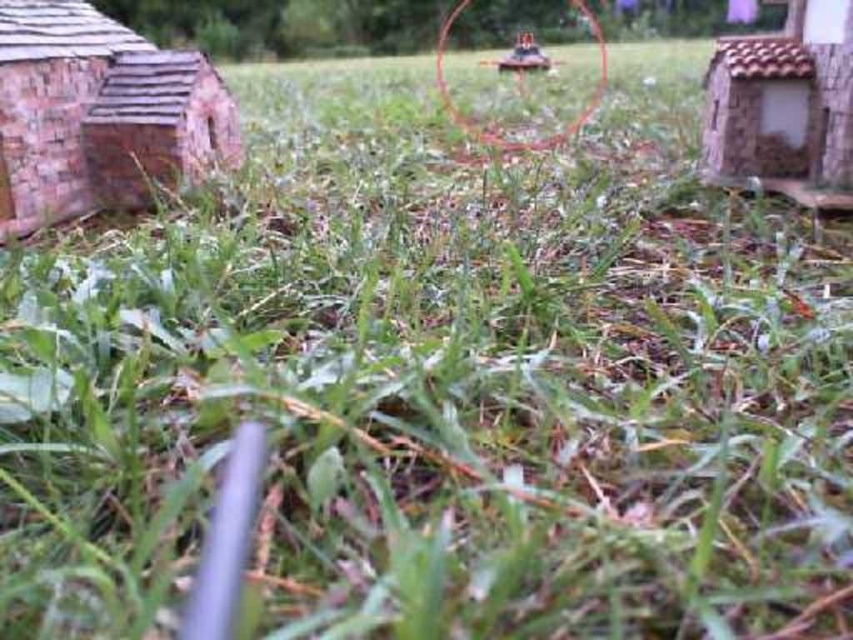
Question: Which point appears closest to the camera in this image?

Choices:
 (A) (486, 61)
 (B) (180, 125)

Answer: (B)

Question: Which of the following is the farthest from the observer?

Choices:
 (A) (796, 177)
 (B) (546, 65)

Answer: (B)

Question: Is rustic stone hut at right below metallic green toy tank at upper center?

Choices:
 (A) yes
 (B) no

Answer: (A)

Question: Is brick textured hut at left bigger than metallic green toy tank at upper center?

Choices:
 (A) yes
 (B) no

Answer: (A)

Question: Is brick textured hut at left above metallic silver miniature at center?

Choices:
 (A) no
 (B) yes

Answer: (A)

Question: Which of the following is the closest to the observer?

Choices:
 (A) metallic green toy tank at upper center
 (B) rustic stone hut at right
 (C) brick textured hut at left

Answer: (B)